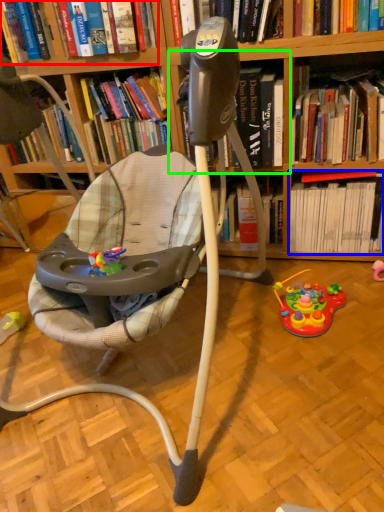
Question: Considering the real-world distances, which object is farthest from book (highlighted by a red box)? book (highlighted by a blue box) or shelf (highlighted by a green box)?

Choices:
 (A) book
 (B) shelf

Answer: (A)